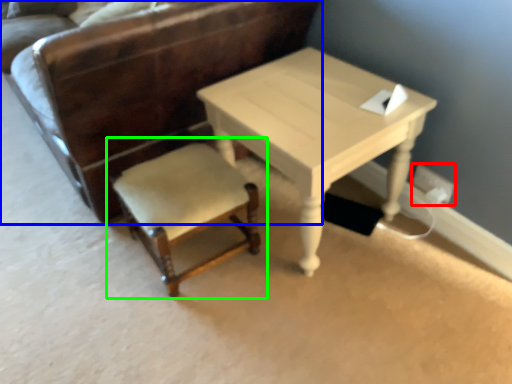
Question: Estimate the real-world distances between objects in this image. Which object is closer to electric outlet (highlighted by a red box), chair (highlighted by a blue box) or chair (highlighted by a green box)?

Choices:
 (A) chair
 (B) chair

Answer: (B)